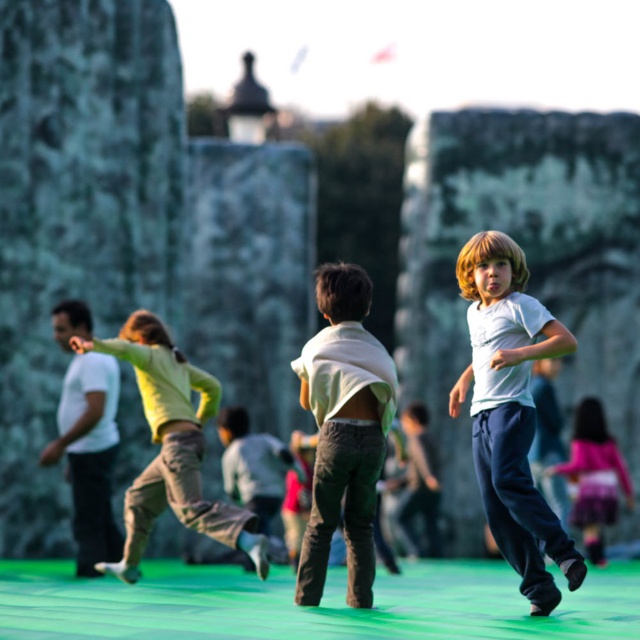
What is the color of the pants at the point marked by coordinates (172,445)?

The pants at the point marked by coordinates (172,445) are light green fabric pants.

You are a photographer trying to capture a clear shot of both the matte white shirt at center and the white matte shirt at left. However, you notice that one of them is blocking the other. Which shirt is being obscured by the other?

The white matte shirt at left is being obscured by the matte white shirt at center because it is positioned over it.

What is the color of the object located at the coordinates point (509, 412)?

The object at point (509, 412) is white matte shirt at center.